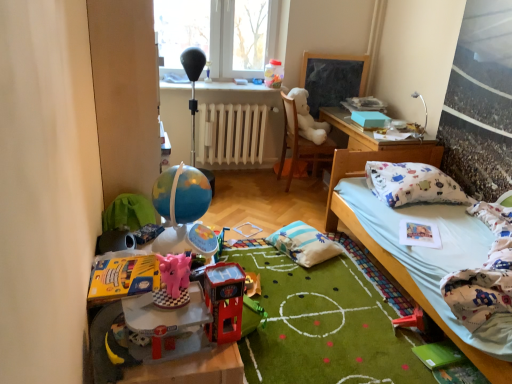
Describe the element at coordinates (411, 320) in the screenshot. I see `rubber red toy at lower right, the 2th toy positioned from the back` at that location.

This screenshot has width=512, height=384. I want to click on translucent plastic container at upper center, acting as the fifth toy starting from the front, so click(274, 74).

The height and width of the screenshot is (384, 512). I want to click on light blue fabric bed at lower right, so click(389, 253).

You are a GUI agent. You are given a task and a screenshot of the screen. Output one action in this format:
    pyautogui.click(x=<x>, y=<y>)
    Task: Click on the pink plastic piggy bank at center, placed as the 2th toy when sorted from front to back
    This screenshot has width=512, height=384.
    Given the screenshot: What is the action you would take?
    pyautogui.click(x=173, y=281)

In order to face pink plastic piggy bank at lower left, the first toy in the left-to-right sequence, should I rotate leftwards or rightwards?

To align with it, rotate left about 11.953°.

In order to click on transparent plastic window at upper center in this screenshot , I will do `click(223, 34)`.

Is blue striped pillow at center, which appears as the 1th pillow when ordered from the bottom, positioned with its back to translucent plastic container at upper center, the first toy from the back?

That's not correct — blue striped pillow at center, which appears as the 1th pillow when ordered from the bottom, is not looking away from translucent plastic container at upper center, the first toy from the back.

Considering the sizes of objects blue striped pillow at center, positioned as the second pillow in right-to-left order, and translucent plastic container at upper center, the first toy from the top, in the image provided, who is bigger, blue striped pillow at center, positioned as the second pillow in right-to-left order, or translucent plastic container at upper center, the first toy from the top,?

Bigger between the two is blue striped pillow at center, positioned as the second pillow in right-to-left order.

Which object is wider, blue striped pillow at center, which appears as the 2th pillow when viewed from the top, or translucent plastic container at upper center, the first toy from the top?

Wider between the two is blue striped pillow at center, which appears as the 2th pillow when viewed from the top.

Is point (301, 242) closer or farther from the camera than point (283, 76)?

Point (301, 242) appears to be closer to the viewer than point (283, 76).

Is white plush bear at center bigger than white fabric pillow at right, which appears as the second pillow when viewed from the left?

Yes.

Between white plush bear at center and white fabric pillow at right, marked as the first pillow in a top-to-bottom arrangement, which one has larger width?

With larger width is white fabric pillow at right, marked as the first pillow in a top-to-bottom arrangement.

Consider the image. Is white plush bear at center positioned beyond the bounds of white fabric pillow at right, marked as the first pillow in a top-to-bottom arrangement?

Yes, white plush bear at center is outside of white fabric pillow at right, marked as the first pillow in a top-to-bottom arrangement.

Considering the sizes of translucent plastic container at upper center, the fourth toy from the left, and light blue fabric bed at lower right in the image, is translucent plastic container at upper center, the fourth toy from the left, wider or thinner than light blue fabric bed at lower right?

translucent plastic container at upper center, the fourth toy from the left, is thinner than light blue fabric bed at lower right.

Is light blue fabric bed at lower right located within translucent plastic container at upper center, placed as the 5th toy when sorted from bottom to top?

Actually, light blue fabric bed at lower right is outside translucent plastic container at upper center, placed as the 5th toy when sorted from bottom to top.

From the image's perspective, is translucent plastic container at upper center, the fourth toy from the left, above or below light blue fabric bed at lower right?

translucent plastic container at upper center, the fourth toy from the left, is situated higher than light blue fabric bed at lower right in the image.

Is translucent plastic container at upper center, which ranks as the second toy in right-to-left order, smaller than light blue fabric bed at lower right?

Correct, translucent plastic container at upper center, which ranks as the second toy in right-to-left order, occupies less space than light blue fabric bed at lower right.

Does point (404, 162) lie behind point (277, 44)?

No, (404, 162) is closer to viewer.

Considering the relative positions of white fabric pillow at right, marked as the first pillow in a top-to-bottom arrangement, and transparent plastic window at upper center in the image provided, is white fabric pillow at right, marked as the first pillow in a top-to-bottom arrangement, behind transparent plastic window at upper center?

No, white fabric pillow at right, marked as the first pillow in a top-to-bottom arrangement, is closer to the viewer.

Considering the relative sizes of white fabric pillow at right, which is the 2th pillow from bottom to top, and transparent plastic window at upper center in the image provided, is white fabric pillow at right, which is the 2th pillow from bottom to top, shorter than transparent plastic window at upper center?

Indeed, white fabric pillow at right, which is the 2th pillow from bottom to top, has a lesser height compared to transparent plastic window at upper center.

At what (x,y) coordinates should I click in order to perform the action: click on the 2nd pillow in front when counting from the transparent plastic window at upper center. Please return your answer as a coordinate pair (x, y). Looking at the image, I should click on (412, 184).

Does rubber red toy at lower right, the 2th toy positioned from the back, have a lesser width compared to white plush bear at center?

Yes.

Is rubber red toy at lower right, marked as the fifth toy in a top-to-bottom arrangement, directly adjacent to white plush bear at center?

No, rubber red toy at lower right, marked as the fifth toy in a top-to-bottom arrangement, is not making contact with white plush bear at center.

Considering the sizes of objects rubber red toy at lower right, the 1th toy in the right-to-left sequence, and white plush bear at center in the image provided, who is taller, rubber red toy at lower right, the 1th toy in the right-to-left sequence, or white plush bear at center?

white plush bear at center.

In the scene shown: Is white fabric pillow at right, which appears as the second pillow when viewed from the left, taller than pink plastic piggy bank at center, the fourth toy ordered from the bottom?

Indeed, white fabric pillow at right, which appears as the second pillow when viewed from the left, has a greater height compared to pink plastic piggy bank at center, the fourth toy ordered from the bottom.

Is white fabric pillow at right, which is the 2th pillow from bottom to top, directly adjacent to pink plastic piggy bank at center, acting as the 2th toy starting from the left?

No, white fabric pillow at right, which is the 2th pillow from bottom to top, is not beside pink plastic piggy bank at center, acting as the 2th toy starting from the left.

Which pillow is the 2nd one when counting from the right side of the pink plastic piggy bank at center, marked as the 4th toy in a back-to-front arrangement? Please provide its 2D coordinates.

[(412, 184)]

Measure the distance between white fabric pillow at right, which appears as the second pillow when viewed from the left, and pink plastic piggy bank at center, acting as the 2th toy starting from the left.

white fabric pillow at right, which appears as the second pillow when viewed from the left, and pink plastic piggy bank at center, acting as the 2th toy starting from the left, are 5.93 feet apart from each other.

Are light blue fabric bed at lower right and rubber red toy at lower right, placed as the fourth toy when sorted from front to back, making contact?

No.

From the image's perspective, who appears lower, light blue fabric bed at lower right or rubber red toy at lower right, marked as the fifth toy in a top-to-bottom arrangement?

rubber red toy at lower right, marked as the fifth toy in a top-to-bottom arrangement, appears lower in the image.

Is light blue fabric bed at lower right taller than rubber red toy at lower right, which appears as the 1th toy when ordered from the bottom?

Indeed, light blue fabric bed at lower right has a greater height compared to rubber red toy at lower right, which appears as the 1th toy when ordered from the bottom.

Between point (458, 339) and point (411, 317), which one is positioned behind?

The point (411, 317) is farther from the camera.

From the blue striped pillow at center, which appears as the 1th pillow when ordered from the bottom, count the 1st toy to the left and point to it. Please provide its 2D coordinates.

[(274, 74)]

Find the location of a particular element. This screenshot has height=384, width=512. the 1st pillow below when counting from the white plush bear at center (from the image's perspective) is located at coordinates (412, 184).

Based on the photo, based on their spatial positions, is white plush bear at center or white fabric pillow at right, which appears as the second pillow when viewed from the left, closer to shiny plastic toy car at center, which ranks as the 3th toy in bottom-to-top order?

white fabric pillow at right, which appears as the second pillow when viewed from the left, lies closer to shiny plastic toy car at center, which ranks as the 3th toy in bottom-to-top order, than the other object.

From the image, which object appears to be farther from pink plastic piggy bank at center, which is the fourth toy in right-to-left order, white fabric pillow at right, which is the 2th pillow from bottom to top, or transparent plastic window at upper center?

Among the two, transparent plastic window at upper center is located further to pink plastic piggy bank at center, which is the fourth toy in right-to-left order.

Based on the photo, looking at the image, which one is located further to shiny plastic toy car at center, the 3th toy positioned from the right, white matte radiator at center or transparent plastic window at upper center?

Among the two, transparent plastic window at upper center is located further to shiny plastic toy car at center, the 3th toy positioned from the right.

In the scene shown: Estimate the real-world distances between objects in this image. Which object is closer to white matte radiator at center, pink plastic piggy bank at center, marked as the 4th toy in a back-to-front arrangement, or white fabric pillow at right, which is the 2th pillow from bottom to top?

Result: white fabric pillow at right, which is the 2th pillow from bottom to top, is positioned closer to the anchor white matte radiator at center.

Estimate the real-world distances between objects in this image. Which object is further from transparent plastic window at upper center, shiny plastic toy car at center, the 3th toy positioned from the right, or pink plastic piggy bank at center, the fourth toy ordered from the bottom?

The object further to transparent plastic window at upper center is shiny plastic toy car at center, the 3th toy positioned from the right.

Estimate the real-world distances between objects in this image. Which object is closer to shiny plastic toy car at center, acting as the 3th toy starting from the front, white plush bear at center or pink plastic piggy bank at center, acting as the 2th toy starting from the left?

pink plastic piggy bank at center, acting as the 2th toy starting from the left, is positioned closer to the anchor shiny plastic toy car at center, acting as the 3th toy starting from the front.

Looking at the image, which one is located further to translucent plastic container at upper center, the first toy from the top, rubber red toy at lower right, marked as the fifth toy in a top-to-bottom arrangement, or white matte radiator at center?

Among the two, rubber red toy at lower right, marked as the fifth toy in a top-to-bottom arrangement, is located further to translucent plastic container at upper center, the first toy from the top.

Based on the photo, considering their positions, is white plush bear at center positioned closer to pink plastic piggy bank at center, placed as the 2th toy when sorted from front to back, than pink plastic piggy bank at lower left, the fifth toy when ordered from back to front?

Among the two, pink plastic piggy bank at lower left, the fifth toy when ordered from back to front, is located nearer to pink plastic piggy bank at center, placed as the 2th toy when sorted from front to back.

I want to click on pillow between pink plastic piggy bank at center, placed as the 2th toy when sorted from front to back, and blue striped pillow at center, which appears as the 2th pillow when viewed from the top, from front to back, so click(x=412, y=184).

Where is `toy between transparent plastic window at upper center and white matte radiator at center from top to bottom`? toy between transparent plastic window at upper center and white matte radiator at center from top to bottom is located at coordinates (274, 74).

I want to click on bed positioned between pink plastic piggy bank at lower left, which ranks as the 4th toy in top-to-bottom order, and translucent plastic container at upper center, which ranks as the second toy in right-to-left order, from near to far, so click(x=389, y=253).

Identify the location of toy that lies between transparent plastic window at upper center and white plush bear at center from top to bottom. (274, 74).